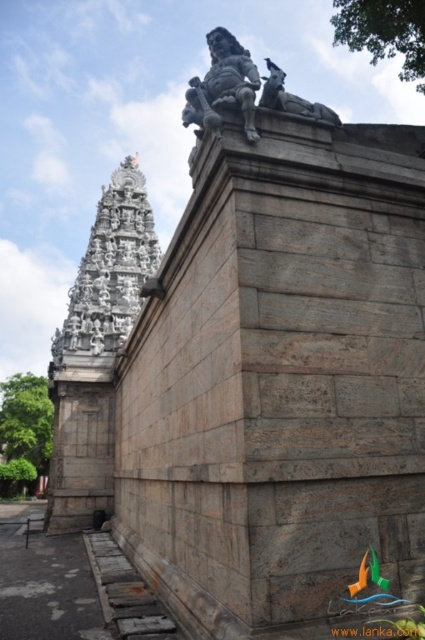
You are an architect examining the historical stone structure. You need to compare the widths of the white stone temple at upper left and the gray stone lion at upper center. Which one is wider?

The white stone temple at upper left is wider than the gray stone lion at upper center because its width surpasses the lion.

You are standing in front of the historical stone structure depicted in the image. There is a white stone temple at upper left located at point (110, 273). If you want to take a photo of the temple spire in the background, which is the tallest structure in the scene, where should you position yourself relative to the white stone temple at upper left?

The white stone temple at upper left is located at point (110, 273). To capture the temple spire in the background, you should position yourself facing towards the direction of the temple spire, which is the tallest structure in the scene, ensuring it is centered in your viewfinder. Since the temple is at upper left, moving slightly to the right or back might help frame the spire properly.

You are an architect examining the historical stone structure. You notice two elements at the upper center of the image. Which one is positioned lower between the slate gray stone statue at upper center and the gray stone lion at upper center?

The slate gray stone statue at upper center is positioned lower than the gray stone lion at upper center according to the description.